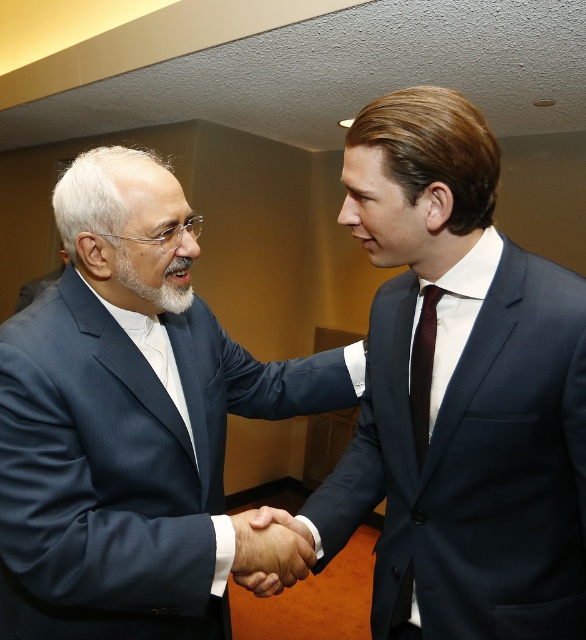
Which is more to the right, dark blue suit at center or smooth skin handshake at center?

dark blue suit at center

Is dark blue suit at center bigger than smooth skin handshake at center?

Yes.

The height and width of the screenshot is (640, 586). Describe the element at coordinates (461, 392) in the screenshot. I see `dark blue suit at center` at that location.

This screenshot has width=586, height=640. In order to click on dark blue suit at center in this screenshot , I will do `click(461, 392)`.

Is dark blue suit at center in front of matte black suit at center?

No, dark blue suit at center is further to the viewer.

At what (x,y) coordinates should I click in order to perform the action: click on dark blue suit at center. Please return your answer as a coordinate pair (x, y). Looking at the image, I should click on (461, 392).

Between matte black suit at center and white soft beard at center, which one is positioned lower?

matte black suit at center

The image size is (586, 640). Find the location of `matte black suit at center`. matte black suit at center is located at coordinates (128, 426).

Locate an element on the screen. The image size is (586, 640). matte black suit at center is located at coordinates (128, 426).